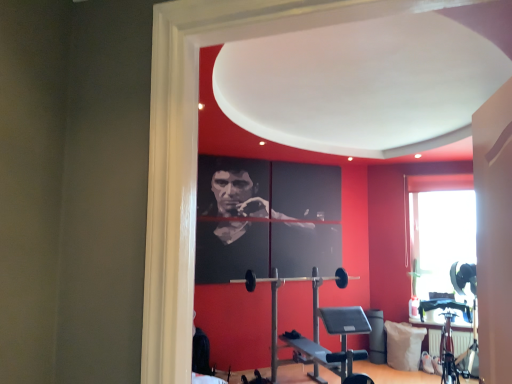
Question: Is point (421, 331) closer or farther from the camera than point (336, 271)?

Choices:
 (A) farther
 (B) closer

Answer: (B)

Question: Considering the positions of white fabric pillow at lower right and black rubber barbell at center in the image, is white fabric pillow at lower right wider or thinner than black rubber barbell at center?

Choices:
 (A) thin
 (B) wide

Answer: (B)

Question: From the image's perspective, is white fabric pillow at lower right above or below black rubber barbell at center?

Choices:
 (A) above
 (B) below

Answer: (B)

Question: Considering the positions of black rubber barbell at center and white fabric pillow at lower right in the image, is black rubber barbell at center wider or thinner than white fabric pillow at lower right?

Choices:
 (A) wide
 (B) thin

Answer: (B)

Question: Relative to white fabric pillow at lower right, is black rubber barbell at center in front or behind?

Choices:
 (A) behind
 (B) front

Answer: (B)

Question: From the image's perspective, is black rubber barbell at center positioned above or below white fabric pillow at lower right?

Choices:
 (A) below
 (B) above

Answer: (B)

Question: Would you say black rubber barbell at center is to the left or to the right of white fabric pillow at lower right in the picture?

Choices:
 (A) right
 (B) left

Answer: (B)